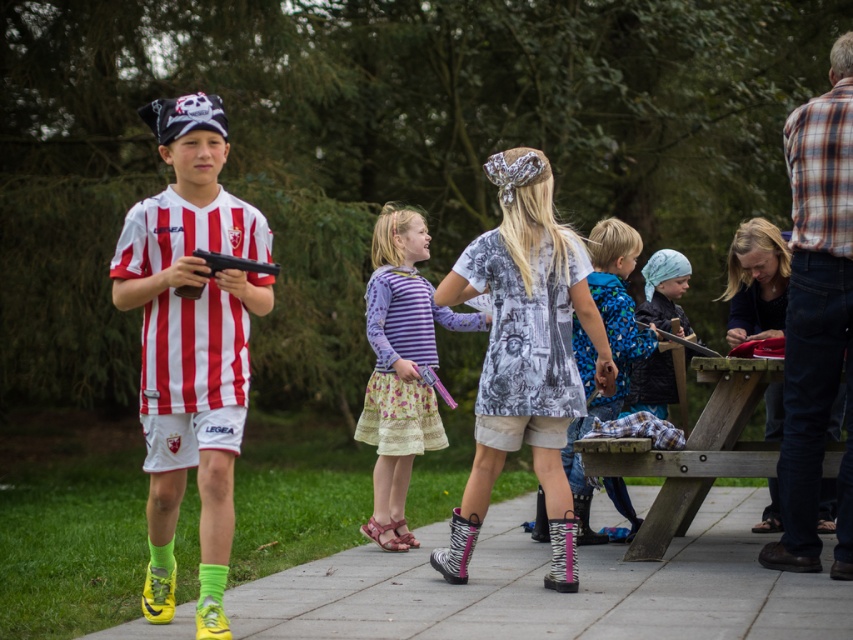
You are a photographer trying to capture a closeup of the soccer player in the scene. You have two points marked in the image, point A at coordinates point (206,572) and point B at coordinates point (563,449). Which point should you focus on to get the closest shot of the soccer player?

Point A at coordinates point (206,572) is closer to the viewer than point B at coordinates point (563,449), so focusing on point A will provide a closer shot of the soccer player.